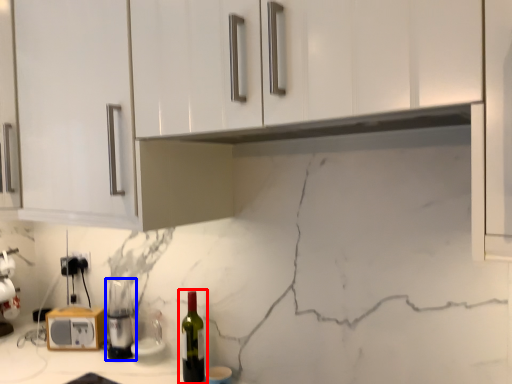
Question: Which object is closer to the camera taking this photo, bottle (highlighted by a red box) or appliance (highlighted by a blue box)?

Choices:
 (A) bottle
 (B) appliance

Answer: (A)